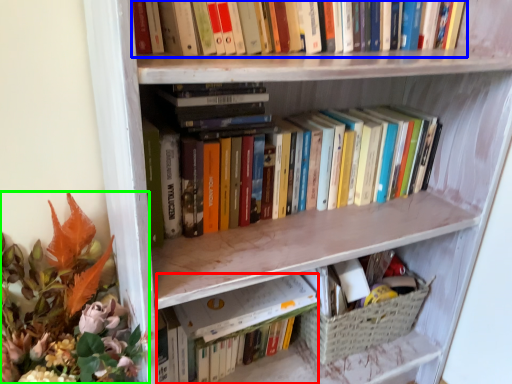
Question: Which object is positioned closest to paperback book (highlighted by a red box)? Select from book (highlighted by a blue box) and floral arrangement (highlighted by a green box).

Choices:
 (A) book
 (B) floral arrangement

Answer: (B)